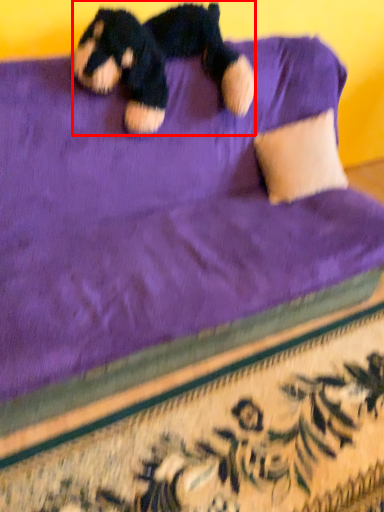
Question: In this image, where is teddy bear (annotated by the red box) located relative to pillow?

Choices:
 (A) left
 (B) right

Answer: (A)